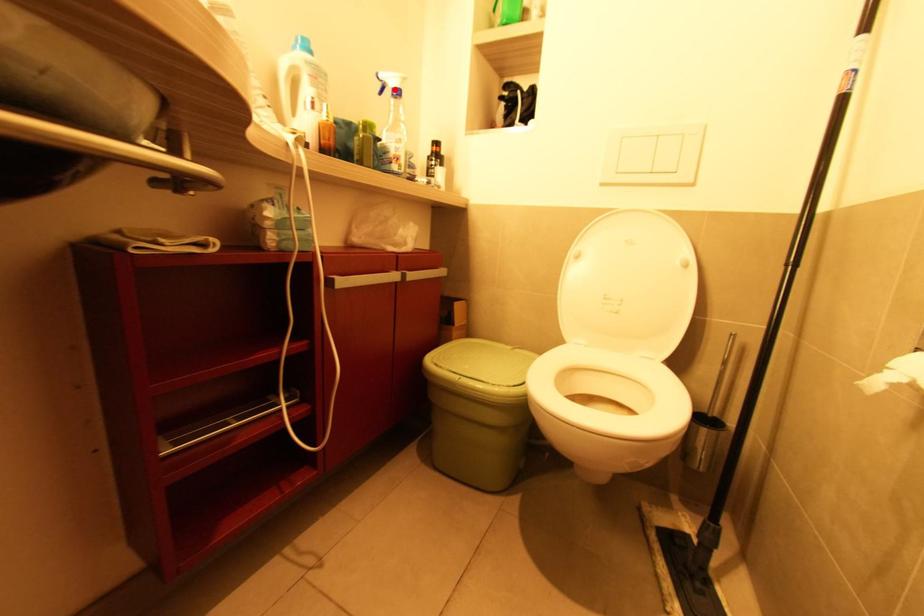
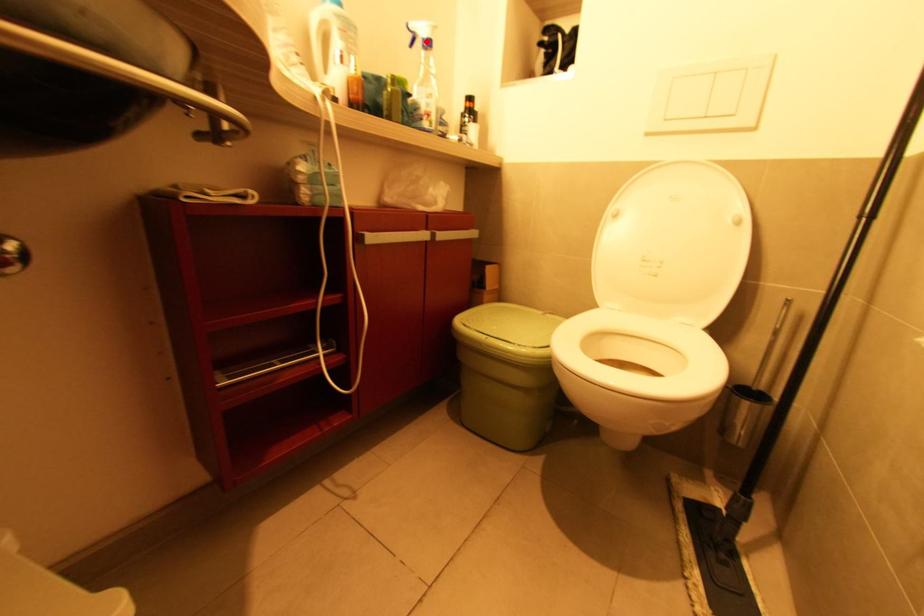
I am providing you with two images of the same scene from different viewpoints. A red point is marked on the first image and another point is marked on the second image. Is the marked point in image1 the same physical position as the marked point in image2?

Yes